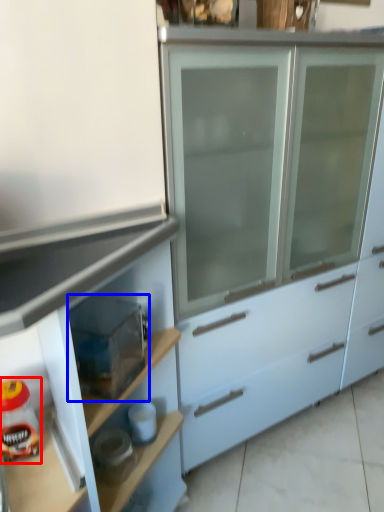
Question: Which of the following is the farthest to the observer, food (highlighted by a red box) or appliance (highlighted by a blue box)?

Choices:
 (A) food
 (B) appliance

Answer: (A)